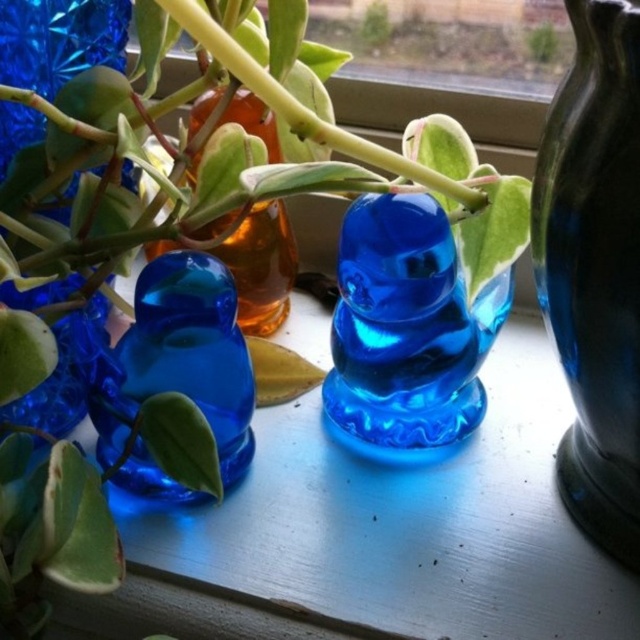
Question: Among these points, which one is nearest to the camera?

Choices:
 (A) (406, 204)
 (B) (225, 413)
 (C) (576, 408)

Answer: (A)

Question: Can you confirm if matte black vase at right is bigger than transparent blue glass duck at center?

Choices:
 (A) yes
 (B) no

Answer: (A)

Question: Considering the relative positions of matte black vase at right and transparent glass duck at left in the image provided, where is matte black vase at right located with respect to transparent glass duck at left?

Choices:
 (A) left
 (B) right

Answer: (B)

Question: Can you confirm if matte black vase at right is positioned above transparent blue glass at left?

Choices:
 (A) no
 (B) yes

Answer: (A)

Question: Which of the following is the farthest from the observer?

Choices:
 (A) transparent blue glass at left
 (B) matte black vase at right

Answer: (A)

Question: Which point appears farthest from the camera in this image?

Choices:
 (A) (51, 289)
 (B) (625, 273)
 (C) (444, 278)
 (D) (182, 308)

Answer: (A)